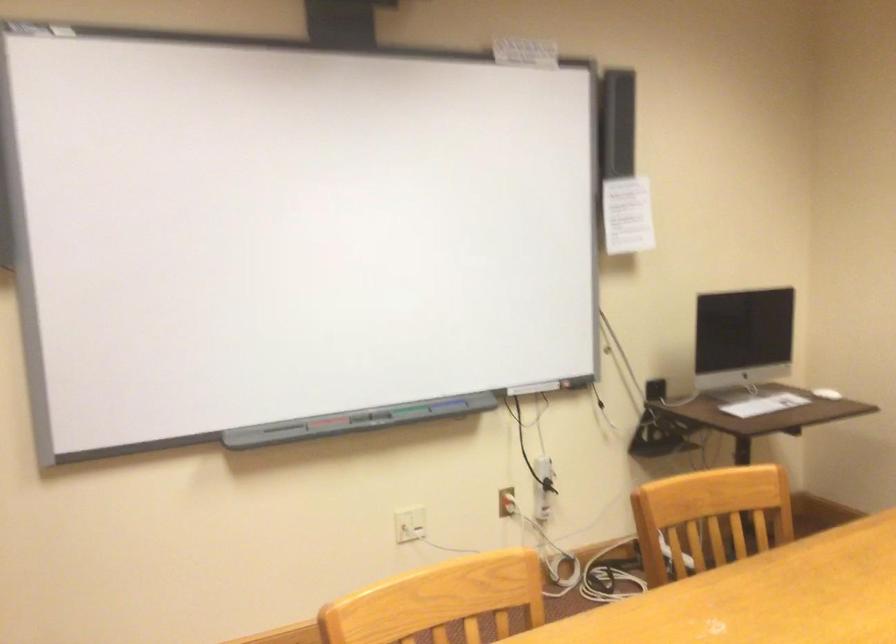
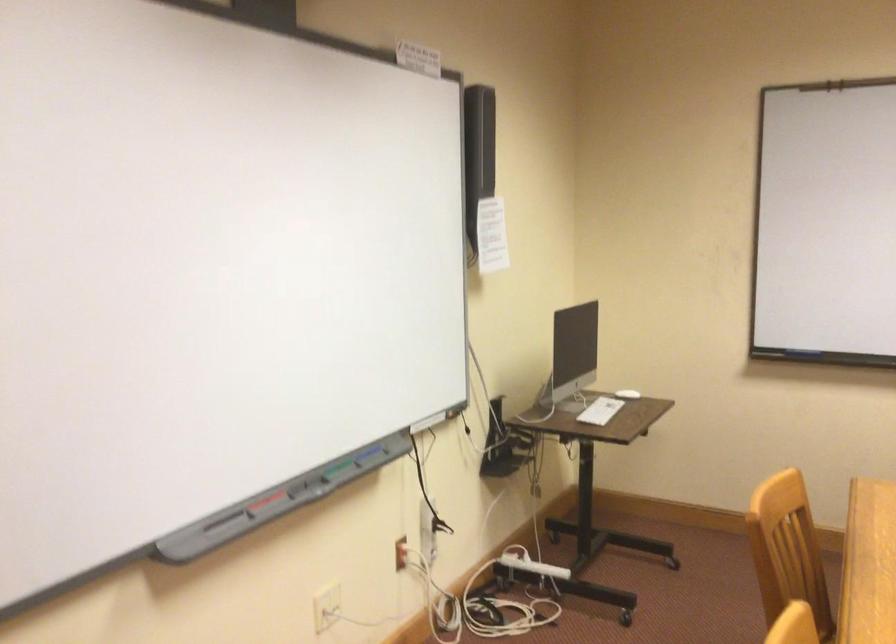
Locate, in the second image, the point that corresponds to pixel 330 422 in the first image.

(264, 502)